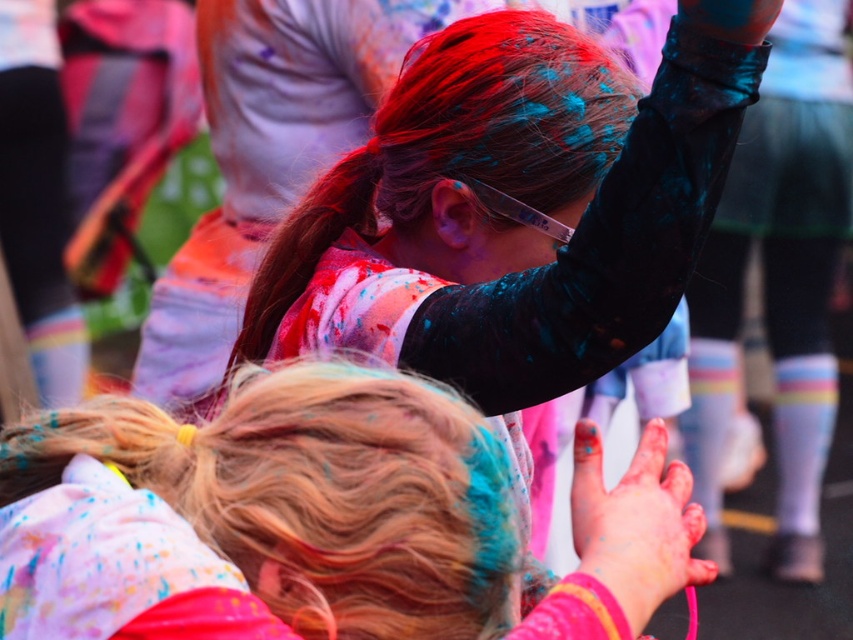
Does blonde hair at center have a greater height compared to painted skin hand at center?

Correct, blonde hair at center is much taller as painted skin hand at center.

How distant is blonde hair at center from painted skin hand at center?

blonde hair at center and painted skin hand at center are 8.14 inches apart.

The height and width of the screenshot is (640, 853). Describe the element at coordinates (318, 520) in the screenshot. I see `blonde hair at center` at that location.

Where is `blonde hair at center`? blonde hair at center is located at coordinates (318, 520).

Which is above, shiny red hair at upper center or painted skin hand at center?

shiny red hair at upper center is above.

The image size is (853, 640). What do you see at coordinates (456, 145) in the screenshot?
I see `shiny red hair at upper center` at bounding box center [456, 145].

Where is `shiny red hair at upper center`? Image resolution: width=853 pixels, height=640 pixels. shiny red hair at upper center is located at coordinates coord(456,145).

Can you confirm if blonde hair at center is positioned above shiny red hair at upper center?

Actually, blonde hair at center is below shiny red hair at upper center.

Is blonde hair at center to the right of shiny red hair at upper center from the viewer's perspective?

No, blonde hair at center is not to the right of shiny red hair at upper center.

The height and width of the screenshot is (640, 853). I want to click on blonde hair at center, so click(318, 520).

This screenshot has width=853, height=640. Identify the location of blonde hair at center. (318, 520).